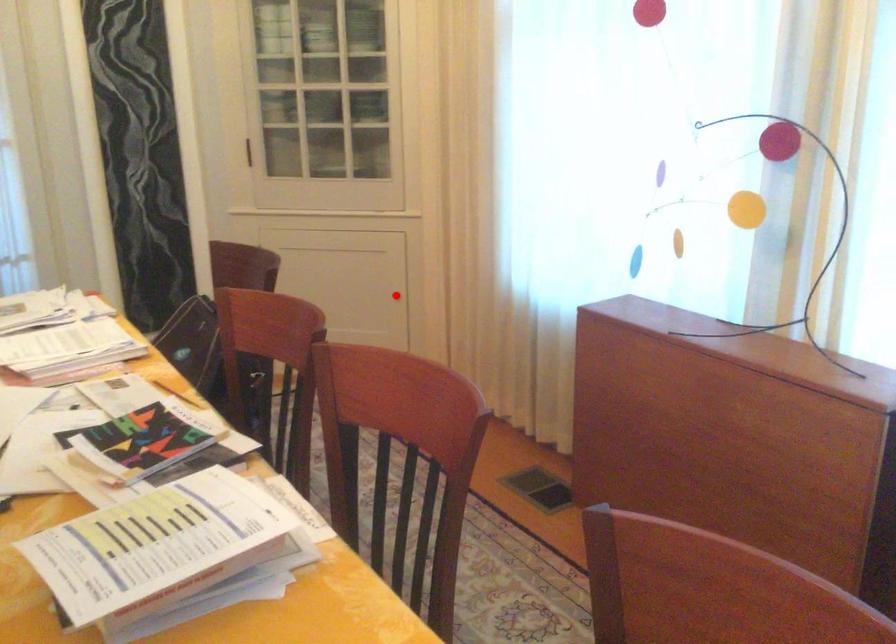
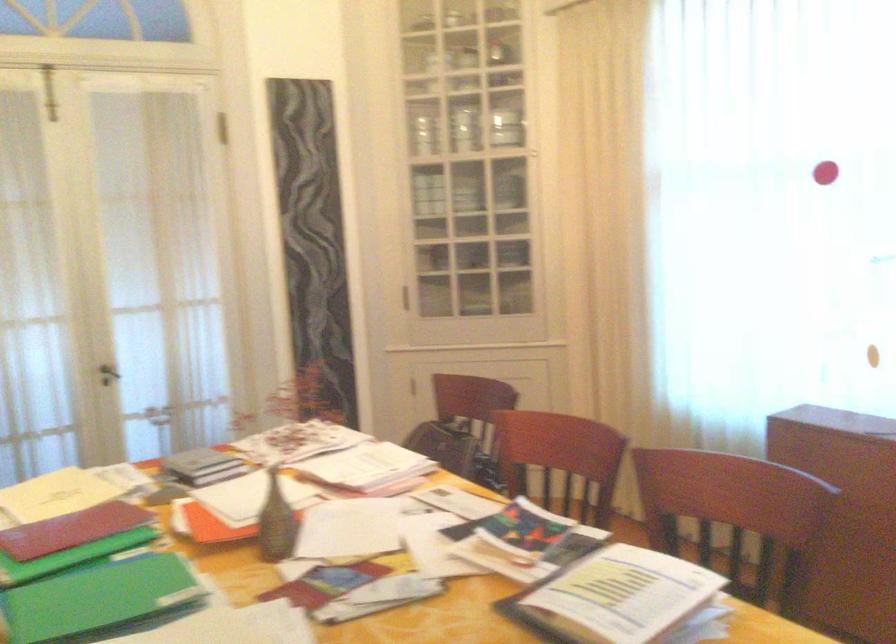
Question: I am providing you with two images of the same scene from different viewpoints. A red point is marked on the first image. Is the red point's position out of view in image 2?

Choices:
 (A) Yes
 (B) No

Answer: (A)